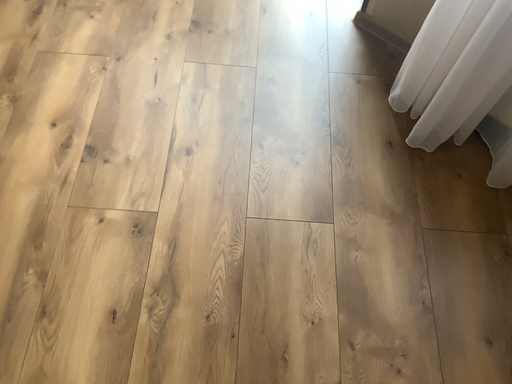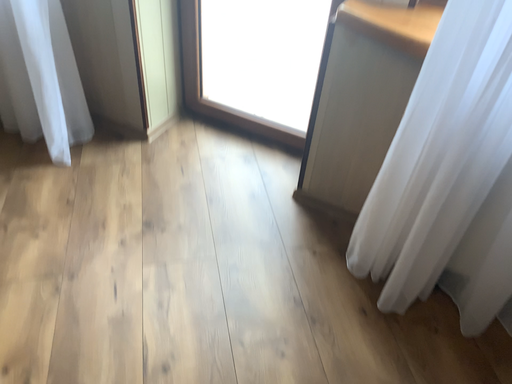
Question: Which way did the camera rotate in the video?

Choices:
 (A) rotated downward
 (B) rotated upward

Answer: (B)